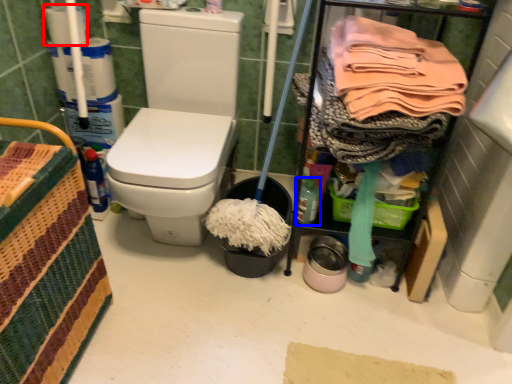
Question: Which point is further to the camera, toilet paper (highlighted by a red box) or bottle (highlighted by a blue box)?

Choices:
 (A) toilet paper
 (B) bottle

Answer: (A)